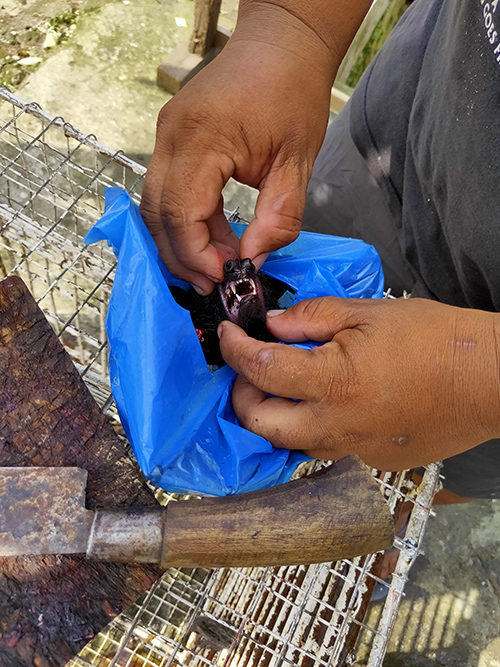
The width and height of the screenshot is (500, 667). In order to click on wood base in this screenshot , I will do click(178, 63).